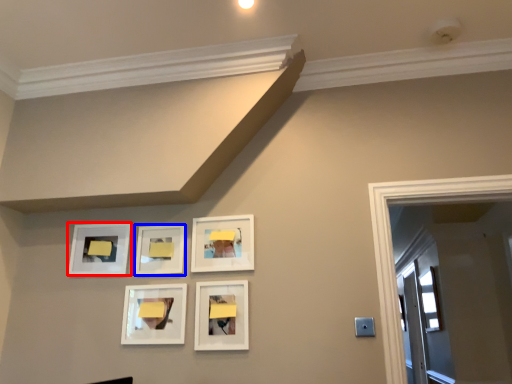
Question: Among these objects, which one is nearest to the camera, picture frame (highlighted by a red box) or picture frame (highlighted by a blue box)?

Choices:
 (A) picture frame
 (B) picture frame

Answer: (B)